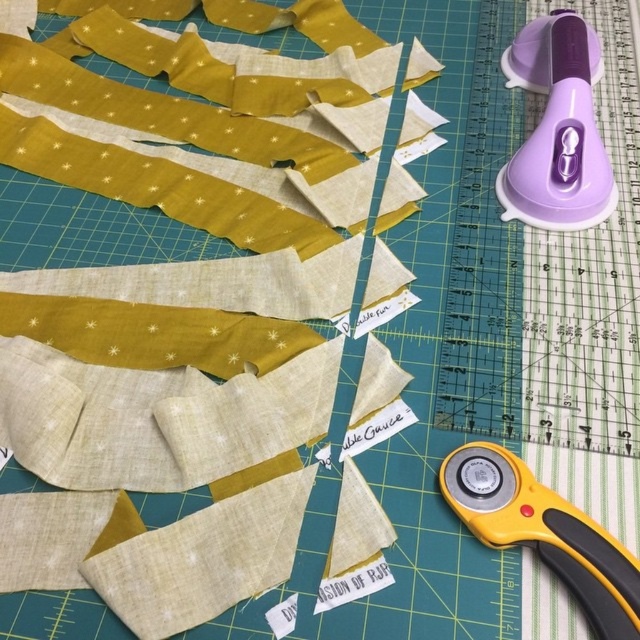
Question: Does purple plastic rotary cutter at upper right appear on the left side of yellow plastic rotary cutter at lower right?

Choices:
 (A) no
 (B) yes

Answer: (A)

Question: Which object is positioned farthest from the matte yellow fabric at upper left?

Choices:
 (A) purple plastic rotary cutter at upper right
 (B) yellow plastic rotary cutter at lower right

Answer: (A)

Question: Does matte yellow fabric at upper left appear under purple plastic rotary cutter at upper right?

Choices:
 (A) yes
 (B) no

Answer: (A)

Question: Can you confirm if matte yellow fabric at upper left is positioned to the left of purple plastic rotary cutter at upper right?

Choices:
 (A) no
 (B) yes

Answer: (B)

Question: Estimate the real-world distances between objects in this image. Which object is farther from the yellow plastic rotary cutter at lower right?

Choices:
 (A) matte yellow fabric at upper left
 (B) purple plastic rotary cutter at upper right

Answer: (B)

Question: Which of the following is the closest to the observer?

Choices:
 (A) (556, 141)
 (B) (566, 540)

Answer: (B)